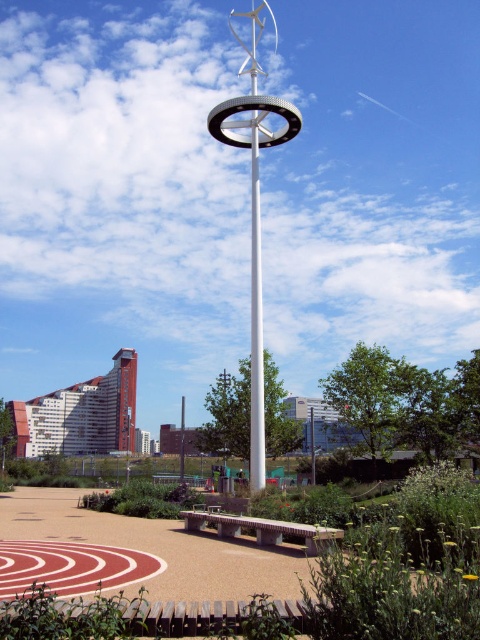
Who is higher up, smooth concrete bench at center or white glossy wind turbine at center?

white glossy wind turbine at center

Who is positioned more to the left, smooth concrete bench at center or white glossy wind turbine at center?

Positioned to the left is white glossy wind turbine at center.

Where is `smooth concrete bench at center`? The image size is (480, 640). smooth concrete bench at center is located at coordinates (383, 564).

Between point (251, 141) and point (312, 550), which one is positioned in front?

Point (312, 550)

Based on the photo, can you confirm if white glossy wind turbine at center is taller than concrete textured bench at center?

Correct, white glossy wind turbine at center is much taller as concrete textured bench at center.

Does point (272, 100) come closer to viewer compared to point (290, 529)?

No, (272, 100) is behind (290, 529).

This screenshot has height=640, width=480. Find the location of `white glossy wind turbine at center`. white glossy wind turbine at center is located at coordinates (254, 205).

Does smooth concrete bench at center appear on the right side of concrete textured bench at center?

Answer: Indeed, smooth concrete bench at center is positioned on the right side of concrete textured bench at center.

Between smooth concrete bench at center and concrete textured bench at center, which one is positioned lower?

Positioned lower is concrete textured bench at center.

What do you see at coordinates (383, 564) in the screenshot? I see `smooth concrete bench at center` at bounding box center [383, 564].

The height and width of the screenshot is (640, 480). Find the location of `smooth concrete bench at center`. smooth concrete bench at center is located at coordinates (383, 564).